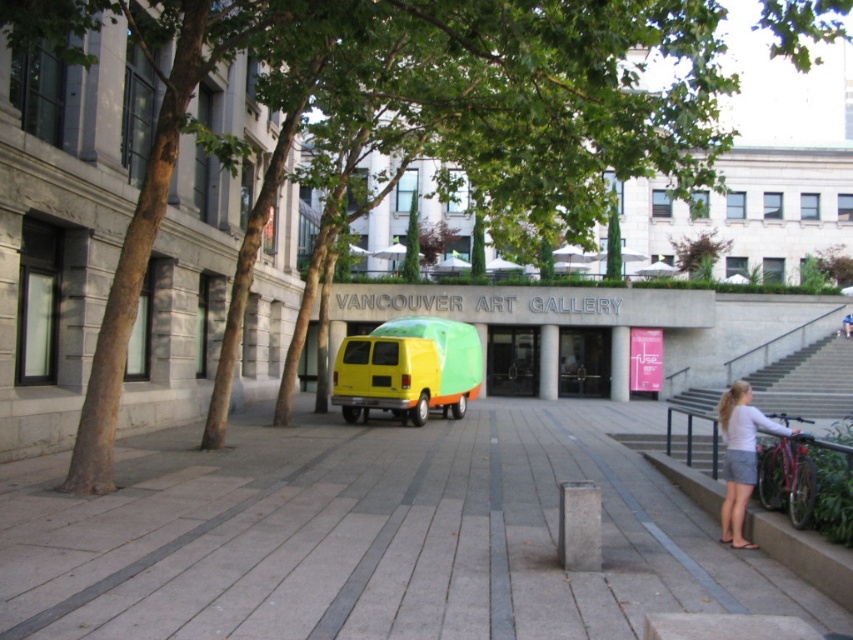
You are a maintenance worker at the Vancouver Art Gallery. You need to place a 4.5 meter long safety barrier between the gray concrete pavement at center and the nearest tree. Is there enough space to place it?

The distance between the gray concrete pavement at center and the nearest tree is 4.47 meters, which is slightly shorter than the 4.5 meter barrier. Therefore, the barrier cannot be placed without overlapping either the pavement or the tree.

You are a pedestrian standing at the entrance of the Vancouver Art Gallery. You see a yellow matte van at center and a light brown leather jacket at lower right. Which object is closer to the left side of the plaza?

The yellow matte van at center is positioned on the left side of light brown leather jacket at lower right, so it is closer to the left side of the plaza.